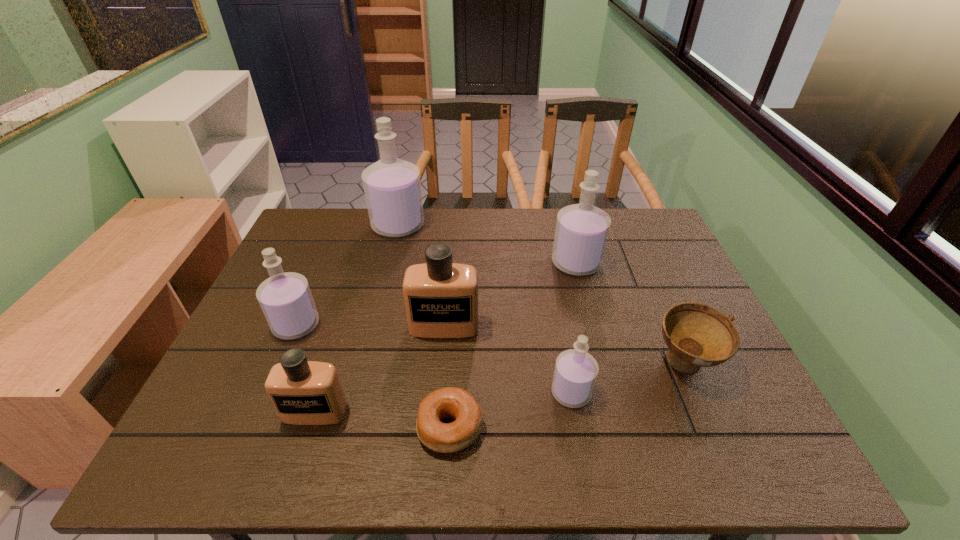
At what (x,y) coordinates should I click in order to perform the action: click on vacant space located on the left of the shortest object. Please return your answer as a coordinate pair (x, y). Looking at the image, I should click on (296, 428).

Locate an element on the screen. The width and height of the screenshot is (960, 540). object at the near edge is located at coordinates (455, 403).

Find the location of `object that is at the left edge`. object that is at the left edge is located at coordinates (286, 300).

Locate an element on the screen. object that is at the right edge is located at coordinates (697, 335).

Find the location of a particular element. This screenshot has width=960, height=540. blank space at the far edge of the desktop is located at coordinates (531, 210).

This screenshot has width=960, height=540. What are the coordinates of `vacant space at the near edge` in the screenshot? It's located at (584, 436).

In the image, there is a desktop. What are the coordinates of `vacant area at the right edge` in the screenshot? It's located at (666, 259).

Locate an element on the screen. free space at the far left corner of the desktop is located at coordinates (294, 250).

Where is `vacant space at the far right corner of the desktop`? vacant space at the far right corner of the desktop is located at coordinates (636, 238).

Find the location of a particular element. The image size is (960, 540). vacant space that is in between the soup bowl and the third purple perfume from right to left is located at coordinates (540, 295).